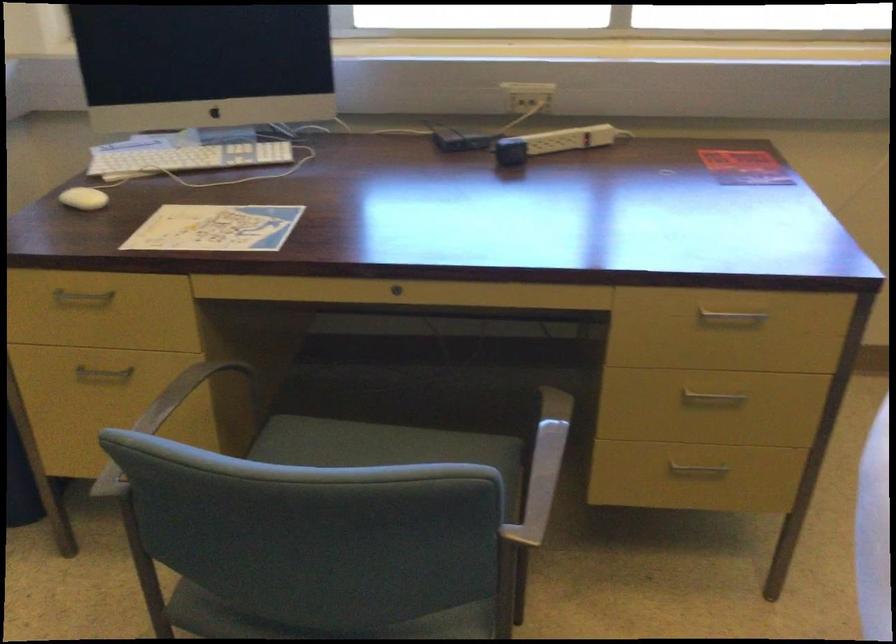
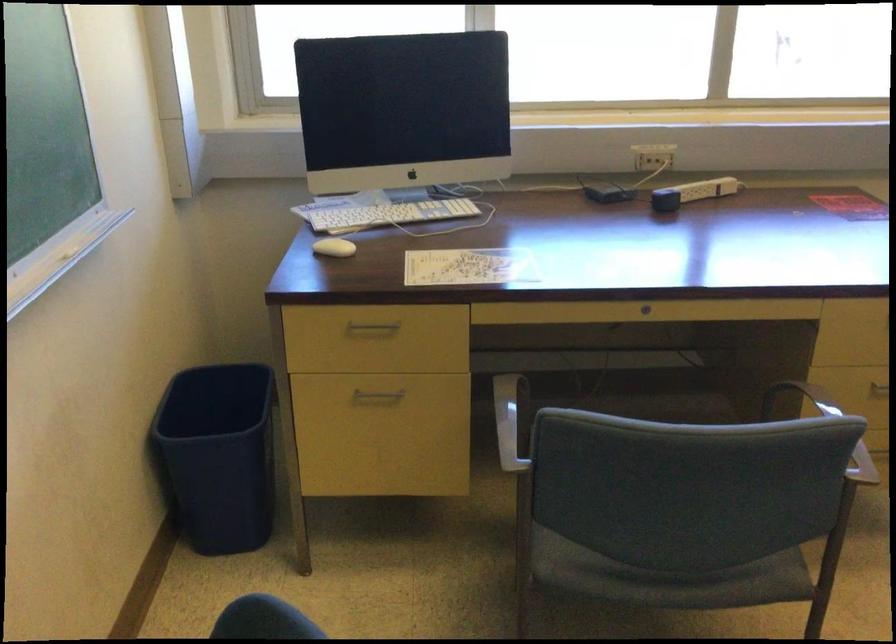
The point at (159, 433) is marked in the first image. Where is the corresponding point in the second image?

(511, 421)